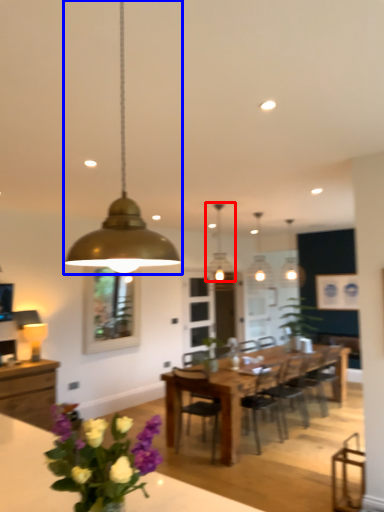
Question: Which object is further to the camera taking this photo, lamp (highlighted by a red box) or lamp (highlighted by a blue box)?

Choices:
 (A) lamp
 (B) lamp

Answer: (A)